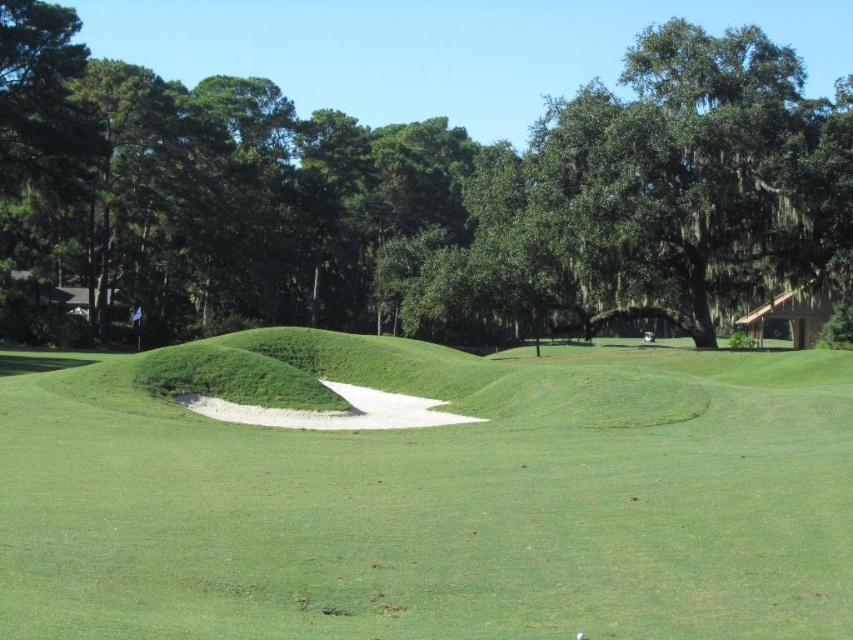
In the scene shown: Is green sand bunker at center to the left of green leafy tree at center from the viewer's perspective?

Indeed, green sand bunker at center is positioned on the left side of green leafy tree at center.

Find the location of a particular element. The width and height of the screenshot is (853, 640). green sand bunker at center is located at coordinates (427, 496).

This screenshot has width=853, height=640. Describe the element at coordinates (427, 496) in the screenshot. I see `green sand bunker at center` at that location.

Find the location of a particular element. Image resolution: width=853 pixels, height=640 pixels. green sand bunker at center is located at coordinates (427, 496).